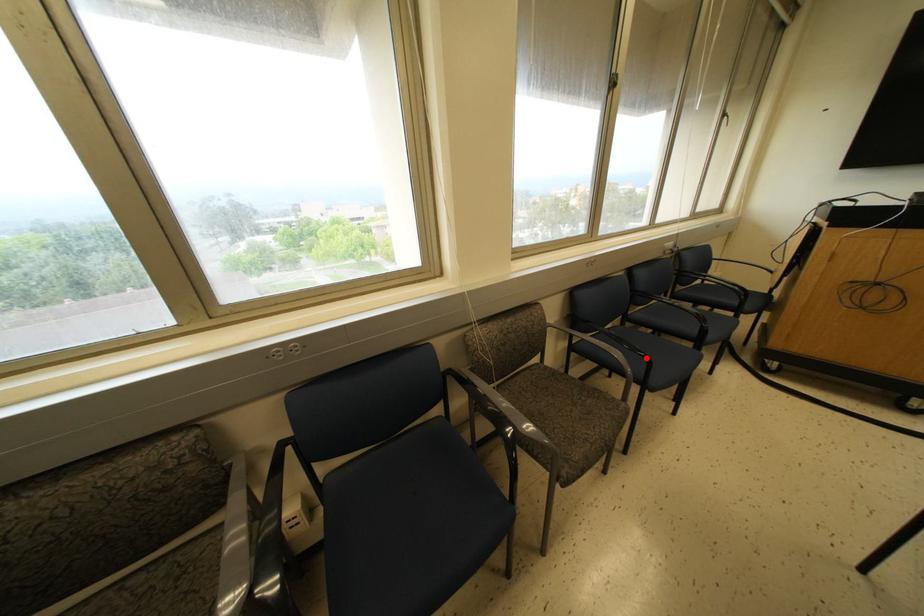
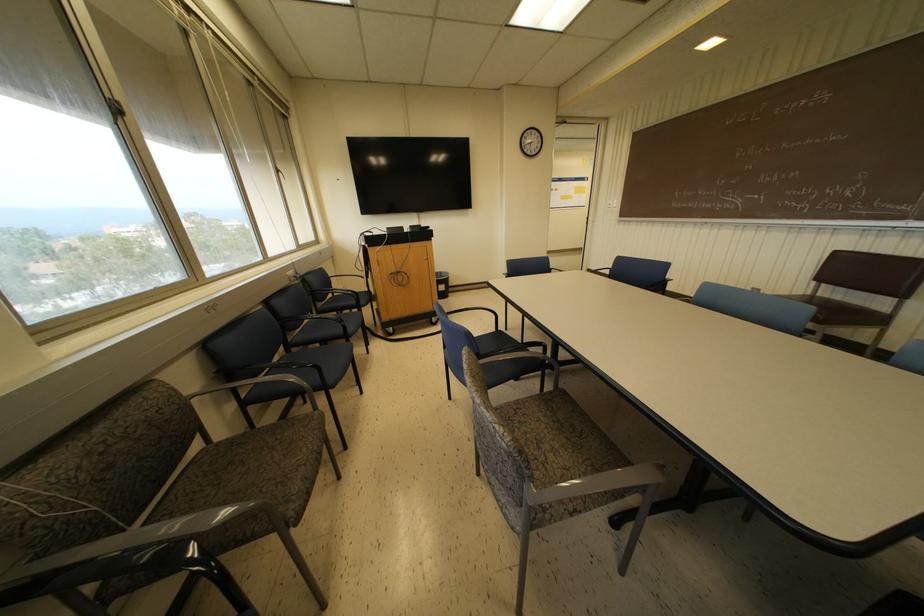
The point at the highlighted location is marked in the first image. Where is the corresponding point in the second image?

(313, 366)